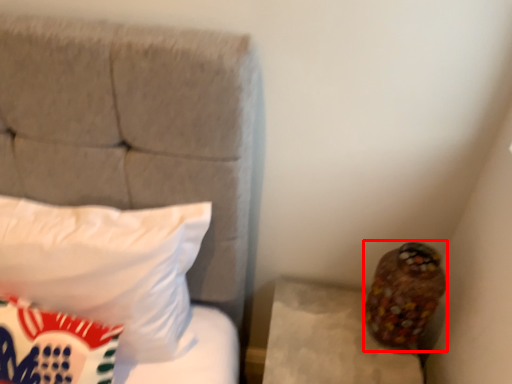
Question: From the image's perspective, what is the correct spatial positioning of stuff (annotated by the red box) in reference to pillow?

Choices:
 (A) above
 (B) below

Answer: (B)